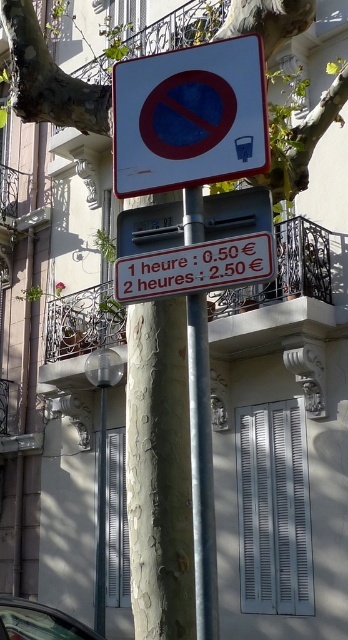
Can you confirm if white plastic sign at upper center is smaller than metallic silver car at lower left?

Actually, white plastic sign at upper center might be larger than metallic silver car at lower left.

What do you see at coordinates (190, 116) in the screenshot? I see `white plastic sign at upper center` at bounding box center [190, 116].

Is point (147, 156) positioned in front of point (76, 632)?

That is True.

This screenshot has width=348, height=640. I want to click on white plastic sign at upper center, so click(190, 116).

Is silver metallic pole at center thinner than metallic silver car at lower left?

Yes, silver metallic pole at center is thinner than metallic silver car at lower left.

Is silver metallic pole at center to the left of metallic silver car at lower left from the viewer's perspective?

In fact, silver metallic pole at center is to the right of metallic silver car at lower left.

The width and height of the screenshot is (348, 640). In order to click on silver metallic pole at center in this screenshot , I will do `click(201, 468)`.

Is white plastic sign at upper center to the left of silver metallic pole at center from the viewer's perspective?

Indeed, white plastic sign at upper center is positioned on the left side of silver metallic pole at center.

Who is more forward, (133,180) or (200,384)?

Point (200,384)

Is point (194, 150) positioned before point (201, 371)?

That is False.

Find the location of a particular element. The width and height of the screenshot is (348, 640). white plastic sign at upper center is located at coordinates (190, 116).